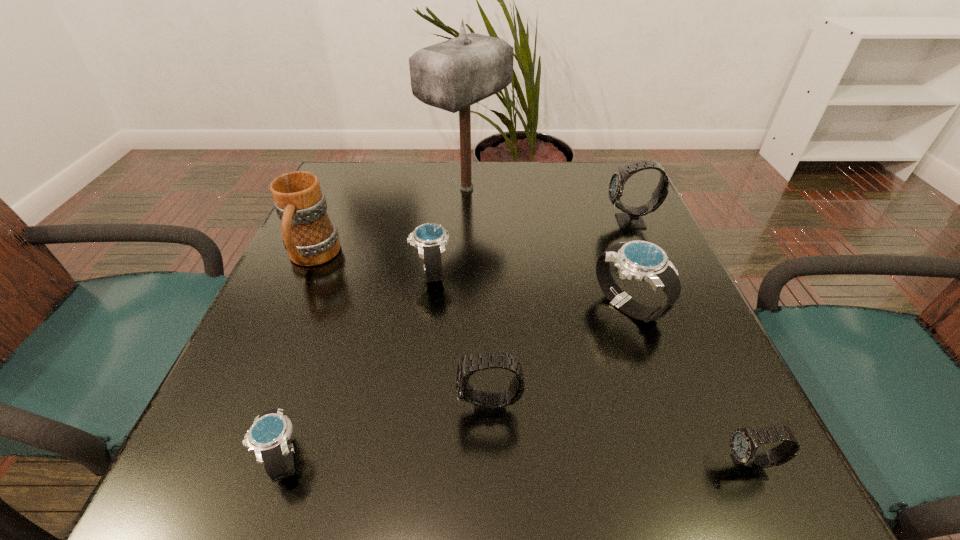
Where is `the shortest watch`? The width and height of the screenshot is (960, 540). the shortest watch is located at coordinates (269, 437).

Identify the location of the smallest silver watch. The image size is (960, 540). (269, 437).

Image resolution: width=960 pixels, height=540 pixels. Find the location of `vacant space located 0.240m on the left of the tallest object`. vacant space located 0.240m on the left of the tallest object is located at coordinates (330, 188).

This screenshot has height=540, width=960. Identify the location of free space located on the side of the mug with the handle. (251, 397).

Find the location of a particular element. The width and height of the screenshot is (960, 540). vacant space located 0.310m on the face of the biggest gray watch is located at coordinates (471, 222).

The height and width of the screenshot is (540, 960). Find the location of `vacant area located 0.260m on the face of the biggest gray watch`. vacant area located 0.260m on the face of the biggest gray watch is located at coordinates (492, 222).

The image size is (960, 540). Identify the location of vacant space located on the face of the biggest gray watch. (496, 222).

In order to click on vacant area located on the back of the biggest silver watch in this screenshot , I will do `click(609, 251)`.

The width and height of the screenshot is (960, 540). Find the location of `vacant position located on the face of the leftmost gray watch`. vacant position located on the face of the leftmost gray watch is located at coordinates (331, 409).

Find the location of `vacant space located 0.250m on the face of the leftmost gray watch`. vacant space located 0.250m on the face of the leftmost gray watch is located at coordinates (x=291, y=409).